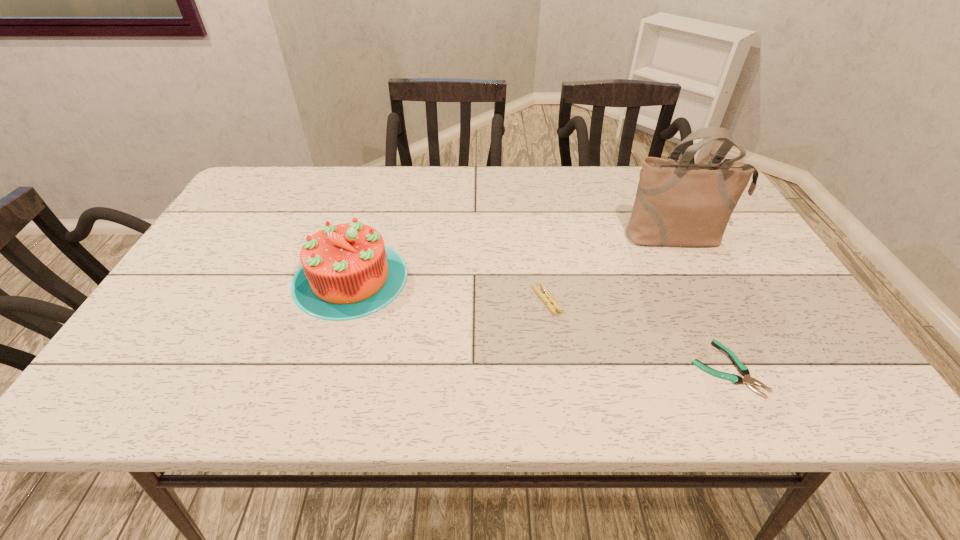
Find the location of a particular element. The width and height of the screenshot is (960, 540). vacant region between the shoulder bag and the nearest object is located at coordinates (702, 303).

The height and width of the screenshot is (540, 960). In order to click on vacant space in between the nearest object and the tallest object in this screenshot , I will do `click(702, 303)`.

The height and width of the screenshot is (540, 960). In order to click on free spot between the third object from right to left and the pliers in this screenshot , I will do `click(636, 334)`.

Identify the location of empty space that is in between the third shortest object and the pliers. The width and height of the screenshot is (960, 540). (539, 323).

Where is `free space between the third object from right to left and the shoulder bag`? The height and width of the screenshot is (540, 960). free space between the third object from right to left and the shoulder bag is located at coordinates (612, 269).

Image resolution: width=960 pixels, height=540 pixels. Identify the location of empty space between the leftmost object and the tallest object. (514, 258).

The width and height of the screenshot is (960, 540). What are the coordinates of `free spot between the second tallest object and the tallest object` in the screenshot? It's located at (514, 258).

Locate an element on the screen. The height and width of the screenshot is (540, 960). object that can be found as the closest to the shoulder bag is located at coordinates (545, 296).

Find the location of `object that is the second closest one to the tallest object`. object that is the second closest one to the tallest object is located at coordinates (743, 370).

You are a GUI agent. You are given a task and a screenshot of the screen. Output one action in this format:
    pyautogui.click(x=<x>, y=<y>)
    Task: Click on the free point that satisfies the following two spatial constraints: 1. on the front side of the third object from right to left; 2. on the right side of the leftmost object
    Image resolution: width=960 pixels, height=540 pixels.
    Given the screenshot: What is the action you would take?
    pyautogui.click(x=344, y=300)